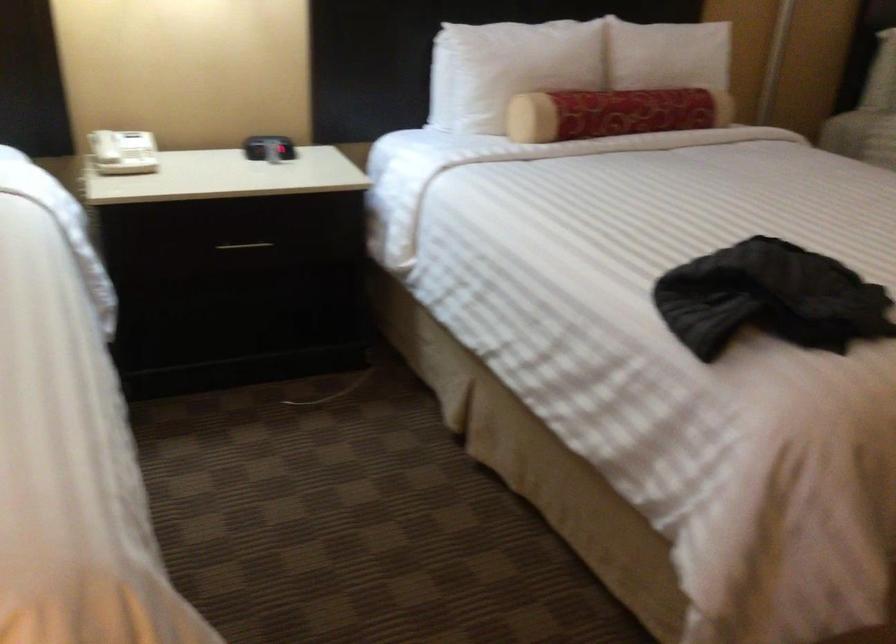
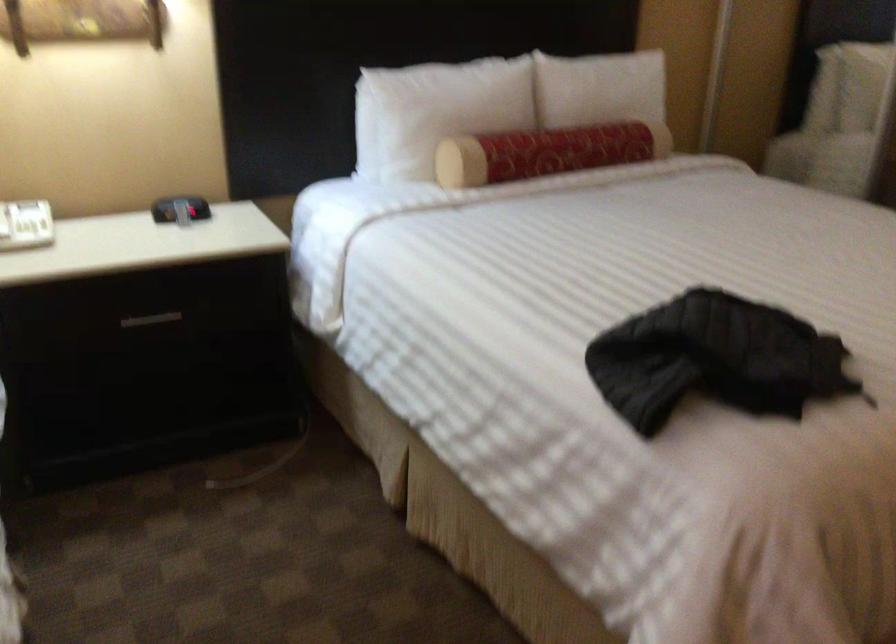
Where in the second image is the point corresponding to [512,67] from the first image?

(435, 111)